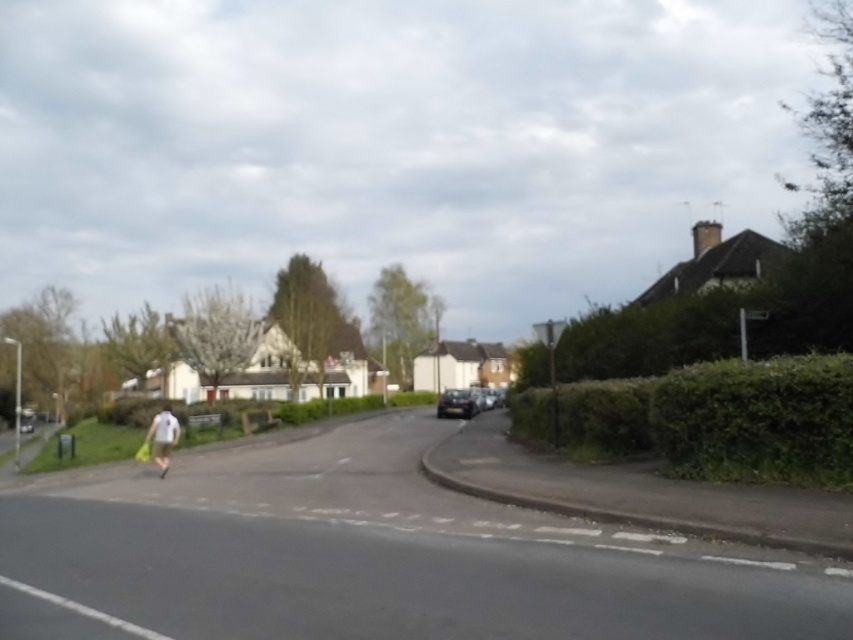
Question: Does white fabric bag at lower left appear on the left side of shiny black car at center?

Choices:
 (A) yes
 (B) no

Answer: (A)

Question: Which of the following is the closest to the observer?

Choices:
 (A) (x=444, y=413)
 (B) (x=154, y=419)

Answer: (B)

Question: Is white fabric bag at lower left smaller than shiny black car at center?

Choices:
 (A) no
 (B) yes

Answer: (A)

Question: Can you confirm if white fabric bag at lower left is thinner than shiny black car at center?

Choices:
 (A) yes
 (B) no

Answer: (B)

Question: Among these objects, which one is farthest from the camera?

Choices:
 (A) shiny black car at center
 (B) white fabric bag at lower left

Answer: (A)